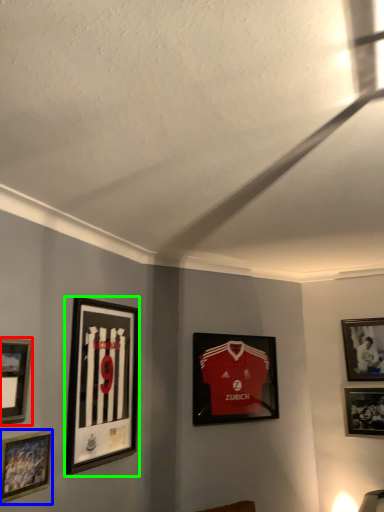
Question: Which object is positioned closest to picture frame (highlighted by a red box)? Select from picture frame (highlighted by a blue box) and picture frame (highlighted by a green box).

Choices:
 (A) picture frame
 (B) picture frame

Answer: (A)